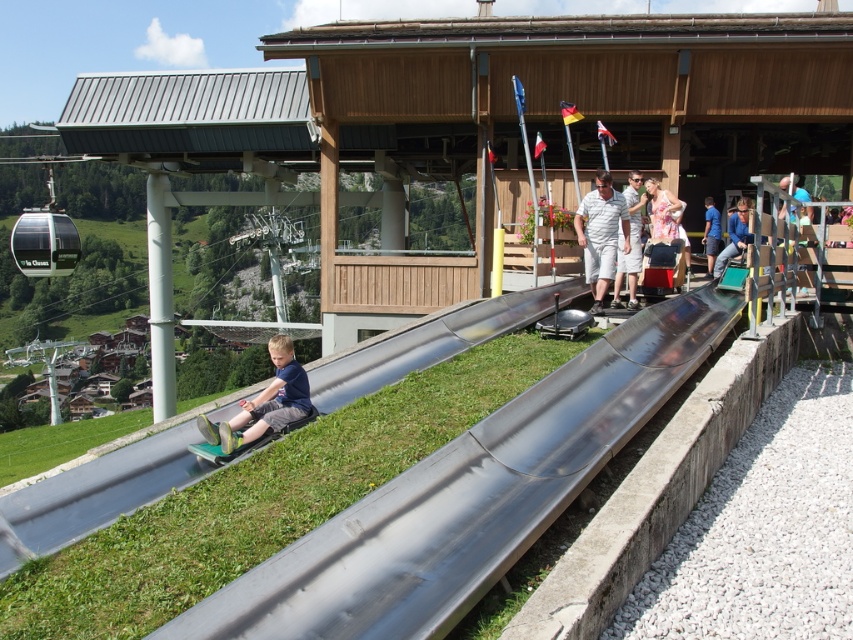
Is matte blue shorts at lower left shorter than light blue striped polo shirt at center?

Yes.

Which is below, matte blue shorts at lower left or light blue striped polo shirt at center?

matte blue shorts at lower left

Does point (282, 376) lie in front of point (630, 182)?

Yes, it is in front of point (630, 182).

In order to click on matte blue shorts at lower left in this screenshot , I will do `click(264, 403)`.

Does white striped shirt at center have a lesser width compared to blue fabric shirt at center?

Incorrect, white striped shirt at center's width is not less than blue fabric shirt at center's.

Is white striped shirt at center smaller than blue fabric shirt at center?

No, white striped shirt at center is not smaller than blue fabric shirt at center.

Image resolution: width=853 pixels, height=640 pixels. I want to click on white striped shirt at center, so click(601, 234).

Which is behind, point (415, 417) or point (712, 250)?

Positioned behind is point (712, 250).

In the scene shown: Who is lower down, green grass at lower left or blue fabric shirt at center?

green grass at lower left is below.

Which is behind, point (183, 600) or point (701, 236)?

Point (701, 236)

Identify the location of green grass at lower left. Image resolution: width=853 pixels, height=640 pixels. (262, 499).